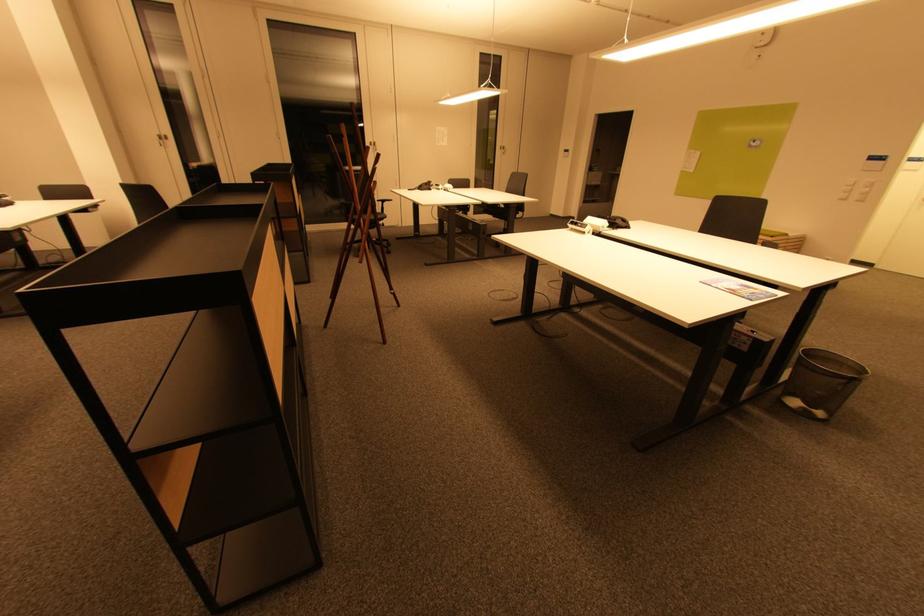
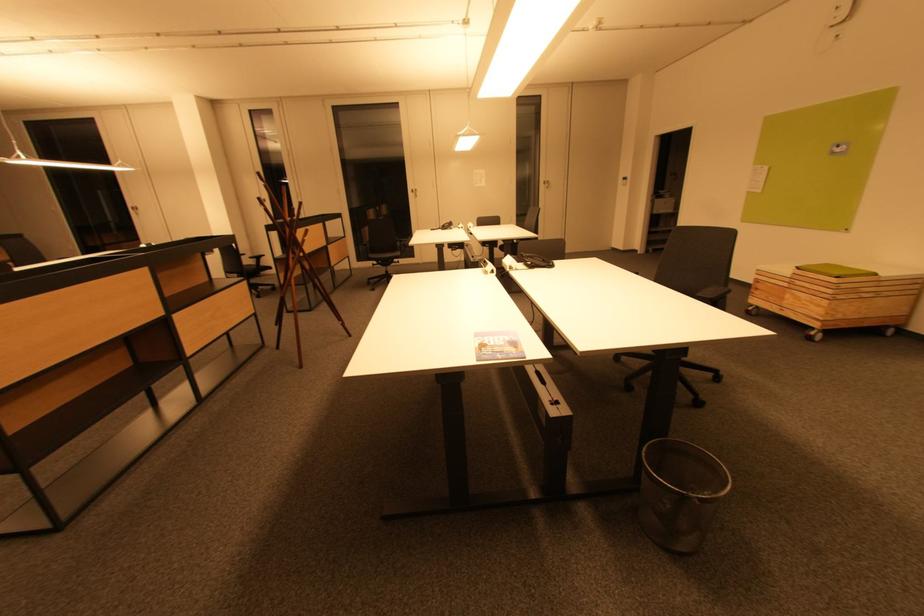
Question: In a continuous first-person perspective shot, in which direction is the camera moving?

Choices:
 (A) Left
 (B) Right
 (C) Forward
 (D) Backward

Answer: (B)